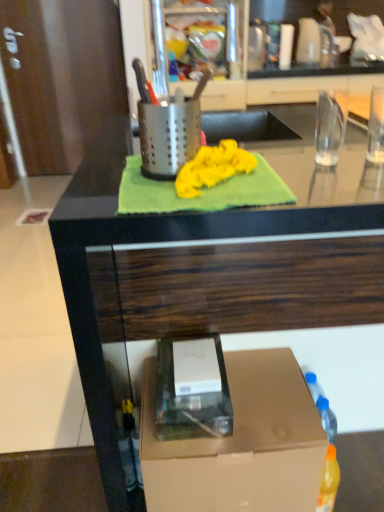
Where is `vacant area on top of brown cardboard box at lower right (from a real-world perspective)`? Image resolution: width=384 pixels, height=512 pixels. vacant area on top of brown cardboard box at lower right (from a real-world perspective) is located at coordinates (235, 403).